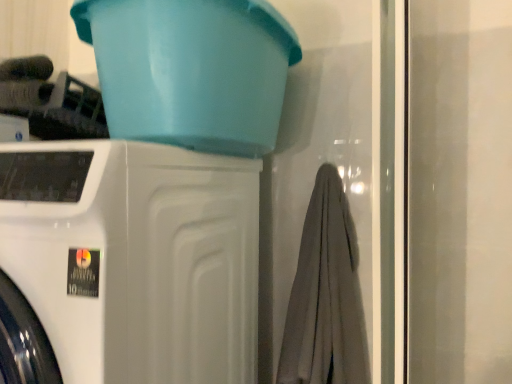
Question: Does gray cotton bath towel at center appear on the left side of white glossy washing machine at left?

Choices:
 (A) no
 (B) yes

Answer: (A)

Question: From the image's perspective, would you say gray cotton bath towel at center is shown under white glossy washing machine at left?

Choices:
 (A) no
 (B) yes

Answer: (A)

Question: Can you confirm if gray cotton bath towel at center is taller than white glossy washing machine at left?

Choices:
 (A) yes
 (B) no

Answer: (B)

Question: Does gray cotton bath towel at center have a larger size compared to white glossy washing machine at left?

Choices:
 (A) no
 (B) yes

Answer: (A)

Question: Is gray cotton bath towel at center beside white glossy washing machine at left?

Choices:
 (A) yes
 (B) no

Answer: (B)

Question: Does gray cotton bath towel at center come behind white glossy washing machine at left?

Choices:
 (A) yes
 (B) no

Answer: (A)

Question: Is white glossy washing machine at left taller than gray cotton bath towel at center?

Choices:
 (A) yes
 (B) no

Answer: (A)

Question: Can you see white glossy washing machine at left touching gray cotton bath towel at center?

Choices:
 (A) yes
 (B) no

Answer: (B)

Question: Is white glossy washing machine at left thinner than gray cotton bath towel at center?

Choices:
 (A) no
 (B) yes

Answer: (A)

Question: Is white glossy washing machine at left oriented away from gray cotton bath towel at center?

Choices:
 (A) no
 (B) yes

Answer: (A)

Question: Does white glossy washing machine at left have a larger size compared to gray cotton bath towel at center?

Choices:
 (A) yes
 (B) no

Answer: (A)

Question: Is white glossy washing machine at left aimed at gray cotton bath towel at center?

Choices:
 (A) no
 (B) yes

Answer: (A)

Question: Is matte plastic basin at upper center positioned before white glossy washing machine at left?

Choices:
 (A) no
 (B) yes

Answer: (A)